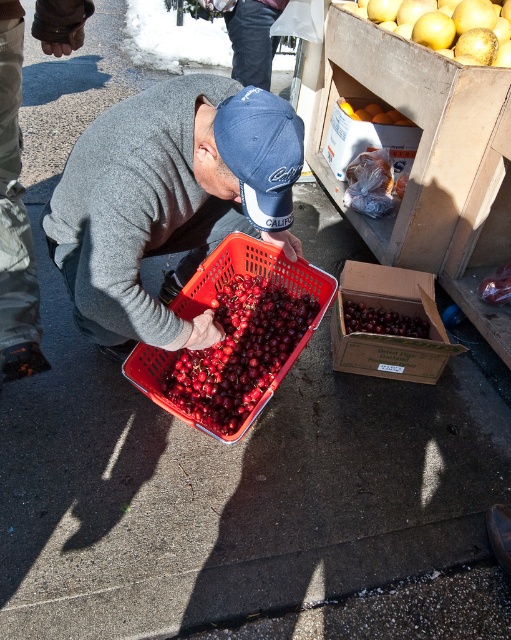
Question: Which point is farther to the camera?

Choices:
 (A) cardboard box of cherries at center
 (B) matte cardboard box at upper right
 (C) smooth orange fruit at center

Answer: (C)

Question: In this image, where is matte plastic basket at center located relative to navy blue fabric baseball cap at center?

Choices:
 (A) above
 (B) below

Answer: (B)

Question: Which point is closer to the camera?

Choices:
 (A) navy blue fabric baseball cap at center
 (B) matte plastic basket at center
 (C) golden smooth potatoes at upper right

Answer: (A)

Question: Can you confirm if matte plastic basket at center is positioned above navy blue fabric baseball cap at center?

Choices:
 (A) no
 (B) yes

Answer: (A)

Question: Can you confirm if matte plastic basket at center is wider than red plastic basket at center?

Choices:
 (A) no
 (B) yes

Answer: (B)

Question: Which is farther from the smooth orange fruit at center?

Choices:
 (A) cardboard box of cherries at center
 (B) matte cardboard box at upper right

Answer: (A)